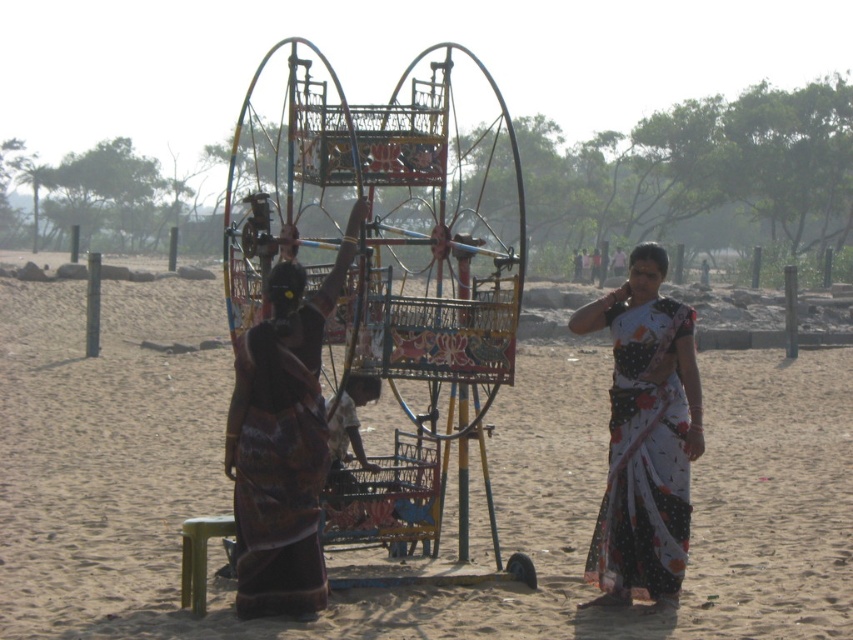
Between metallic painted ferris wheel at center and white dotted saree at center, which one has more height?

With more height is metallic painted ferris wheel at center.

Which is behind, point (251, 221) or point (625, 388)?

The point (251, 221) is more distant.

Measure the distance between metallic painted ferris wheel at center and camera.

metallic painted ferris wheel at center is 9.80 meters away from camera.

The height and width of the screenshot is (640, 853). In order to click on metallic painted ferris wheel at center in this screenshot , I will do `click(303, 209)`.

Who is higher up, brown sand at center or dark brown textured fabric dress at left?

brown sand at center is above.

Does brown sand at center have a greater height compared to dark brown textured fabric dress at left?

Correct, brown sand at center is much taller as dark brown textured fabric dress at left.

The width and height of the screenshot is (853, 640). What are the coordinates of `brown sand at center` in the screenshot? It's located at (490, 472).

Who is shorter, metallic painted ferris wheel at center or dark brown textured fabric dress at left?

Standing shorter between the two is dark brown textured fabric dress at left.

Does metallic painted ferris wheel at center appear under dark brown textured fabric dress at left?

No, metallic painted ferris wheel at center is not below dark brown textured fabric dress at left.

Describe the element at coordinates (303, 209) in the screenshot. I see `metallic painted ferris wheel at center` at that location.

Where is `metallic painted ferris wheel at center`? Image resolution: width=853 pixels, height=640 pixels. metallic painted ferris wheel at center is located at coordinates (303, 209).